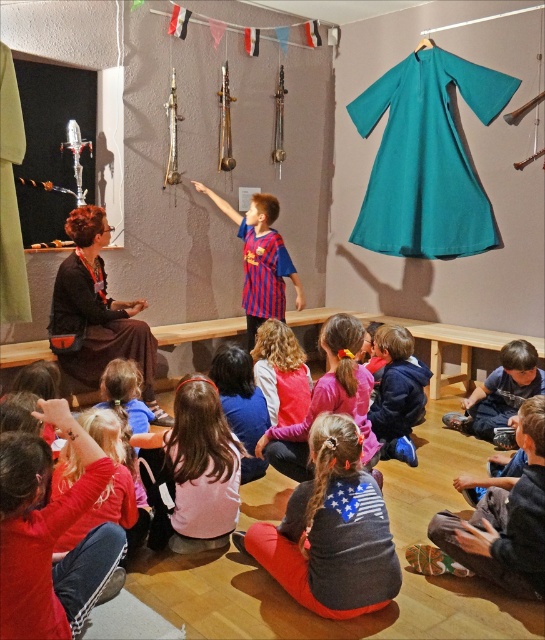
You are a teacher in the classroom and want to arrange the two children wearing the matte brown dress at left and the blue cotton shirt at lower right side by side. Which child should move closer to the other to make them align properly?

The child wearing the matte brown dress at left should move closer to the blue cotton shirt at lower right because the matte brown dress at left might be wider than blue cotton shirt at lower right, so moving it closer would help align them properly.